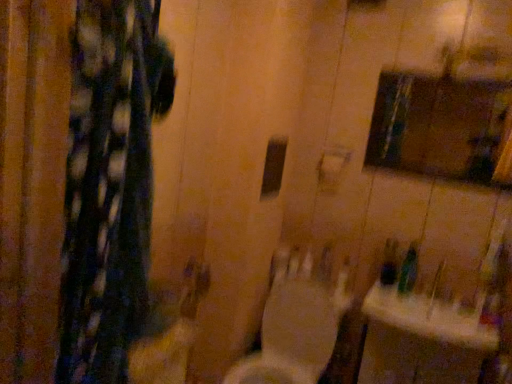
Question: Does white glossy toilet at center appear on the left side of green plastic bottle at lower right?

Choices:
 (A) no
 (B) yes

Answer: (B)

Question: Can you confirm if white glossy toilet at center is taller than green plastic bottle at lower right?

Choices:
 (A) no
 (B) yes

Answer: (B)

Question: From a real-world perspective, is white glossy toilet at center on top of green plastic bottle at lower right?

Choices:
 (A) yes
 (B) no

Answer: (B)

Question: Is the depth of white glossy toilet at center less than that of green plastic bottle at lower right?

Choices:
 (A) yes
 (B) no

Answer: (A)

Question: Can you confirm if white glossy toilet at center is smaller than green plastic bottle at lower right?

Choices:
 (A) no
 (B) yes

Answer: (A)

Question: Is white glossy toilet at center bigger than green plastic bottle at lower right?

Choices:
 (A) yes
 (B) no

Answer: (A)

Question: Does white glossy sink at lower right have a lesser width compared to white glossy toilet at center?

Choices:
 (A) no
 (B) yes

Answer: (B)

Question: Is white glossy sink at lower right to the right of white glossy toilet at center from the viewer's perspective?

Choices:
 (A) yes
 (B) no

Answer: (A)

Question: From a real-world perspective, is white glossy sink at lower right physically below white glossy toilet at center?

Choices:
 (A) yes
 (B) no

Answer: (B)

Question: Could you tell me if white glossy sink at lower right is facing white glossy toilet at center?

Choices:
 (A) no
 (B) yes

Answer: (A)

Question: From a real-world perspective, is white glossy sink at lower right on top of white glossy toilet at center?

Choices:
 (A) no
 (B) yes

Answer: (B)

Question: Is white glossy sink at lower right smaller than white glossy toilet at center?

Choices:
 (A) no
 (B) yes

Answer: (B)

Question: Does matte glass medicine cabinet at upper right appear on the left side of white glossy sink at lower right?

Choices:
 (A) yes
 (B) no

Answer: (B)